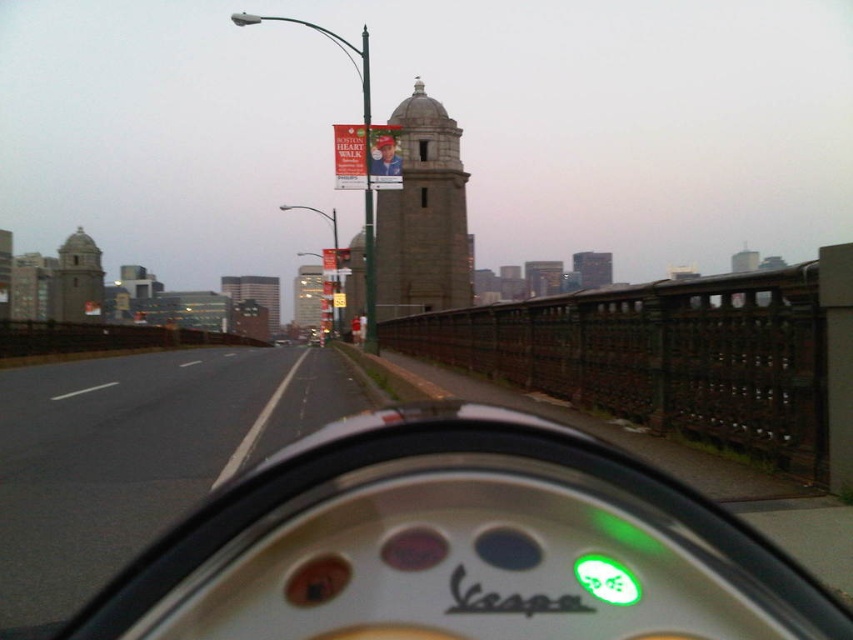
You are riding a white matte vespa at center and want to reach the gray stone tower at center. Given that the Vespa can travel at a maximum speed of 30 mph, how long will it take to reach the tower?

The distance between the white matte vespa at center and the gray stone tower at center is 146.21 feet. Converting this to miles, 146.21 feet is approximately 0.0277 miles. At a speed of 30 mph, the time required would be distance divided by speed, so 0.0277 miles divided by 30 mph equals approximately 0.000923 hours. Converting hours to seconds, 0.000923 hours multiplied by 3600 seconds per hour gives about 3.32 seconds. Therefore, it would take roughly 3 seconds to reach the tower.

You are riding a Vespa scooter and want to know the distance to the point marked as point (798, 634) on the dashboard. Can you reach it without stretching?

The point (798, 634) is 1.22 meters from the camera. Since the average arm length is about 0.7 meters, you can comfortably reach it without stretching.